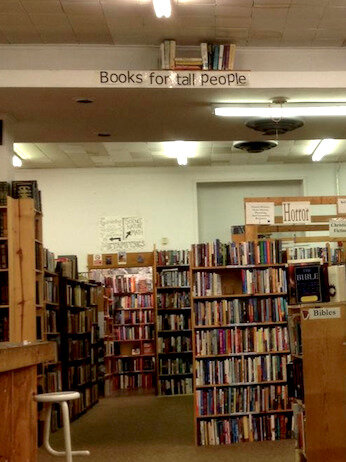
You are a GUI agent. You are given a task and a screenshot of the screen. Output one action in this format:
    pyautogui.click(x=<x>, y=<y>)
    Task: Click on the floor
    The width and height of the screenshot is (346, 462).
    Given the screenshot: What is the action you would take?
    pyautogui.click(x=144, y=402), pyautogui.click(x=131, y=442), pyautogui.click(x=254, y=453), pyautogui.click(x=164, y=423), pyautogui.click(x=115, y=421), pyautogui.click(x=174, y=404), pyautogui.click(x=112, y=404)